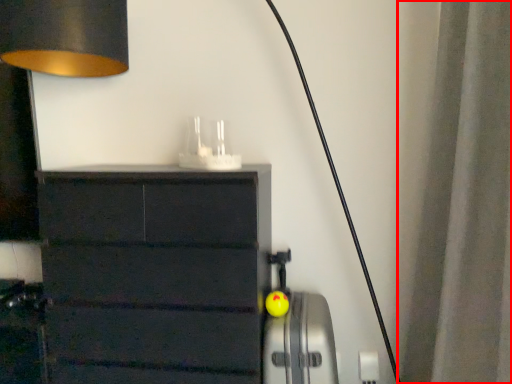
Question: Observing the image, what is the correct spatial positioning of curtain (annotated by the red box) in reference to appliance?

Choices:
 (A) right
 (B) left

Answer: (A)